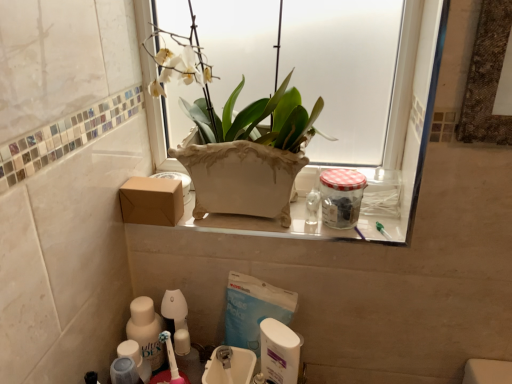
Question: From a real-world perspective, is white plastic container at lower center, positioned as the second cleaning product in left-to-right order, on white plastic sink at lower center, which ranks as the 2th sink in front-to-back order?

Choices:
 (A) no
 (B) yes

Answer: (B)

Question: From the image's perspective, does white plastic container at lower center, the first cleaning product from the right, appear higher than white plastic sink at lower center, which is the first sink from back to front?

Choices:
 (A) no
 (B) yes

Answer: (A)

Question: Is white plastic container at lower center, positioned as the second cleaning product in left-to-right order, positioned before white plastic sink at lower center, which ranks as the 2th sink in front-to-back order?

Choices:
 (A) no
 (B) yes

Answer: (B)

Question: Considering the relative sizes of white plastic container at lower center, positioned as the second cleaning product in left-to-right order, and white plastic sink at lower center, which is the first sink from back to front, in the image provided, is white plastic container at lower center, positioned as the second cleaning product in left-to-right order, taller than white plastic sink at lower center, which is the first sink from back to front,?

Choices:
 (A) no
 (B) yes

Answer: (A)

Question: Is white plastic container at lower center, positioned as the second cleaning product in left-to-right order, completely or partially outside of white plastic sink at lower center, which is the first sink from back to front?

Choices:
 (A) yes
 (B) no

Answer: (A)

Question: Are white plastic container at lower center, the first cleaning product from the right, and white plastic sink at lower center, which ranks as the 2th sink in front-to-back order, beside each other?

Choices:
 (A) yes
 (B) no

Answer: (A)

Question: Does white glossy sink at lower center, arranged as the first sink when viewed from the front, have a lesser width compared to white glossy ceramic vase at upper center?

Choices:
 (A) yes
 (B) no

Answer: (A)

Question: Is white glossy sink at lower center, arranged as the first sink when viewed from the front, at the left side of white glossy ceramic vase at upper center?

Choices:
 (A) no
 (B) yes

Answer: (B)

Question: Is white glossy sink at lower center, which is counted as the second sink, starting from the back, outside of white glossy ceramic vase at upper center?

Choices:
 (A) no
 (B) yes

Answer: (B)

Question: Is white glossy sink at lower center, which is counted as the second sink, starting from the back, facing towards white glossy ceramic vase at upper center?

Choices:
 (A) no
 (B) yes

Answer: (A)

Question: Does white glossy sink at lower center, arranged as the first sink when viewed from the front, have a lesser height compared to white glossy ceramic vase at upper center?

Choices:
 (A) yes
 (B) no

Answer: (A)

Question: Is the depth of white glossy sink at lower center, arranged as the first sink when viewed from the front, greater than that of white glossy ceramic vase at upper center?

Choices:
 (A) no
 (B) yes

Answer: (B)

Question: Does clear glass jar at upper right have a smaller size compared to translucent plastic bottle at lower left, which is the 1th cleaning product in left-to-right order?

Choices:
 (A) no
 (B) yes

Answer: (B)